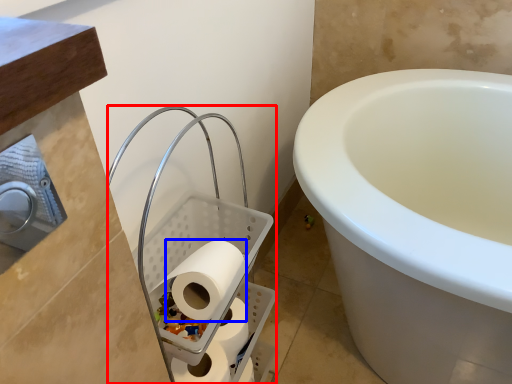
Question: Which of the following is the farthest to the observer, laundry basket (highlighted by a red box) or toilet paper (highlighted by a blue box)?

Choices:
 (A) laundry basket
 (B) toilet paper

Answer: (B)